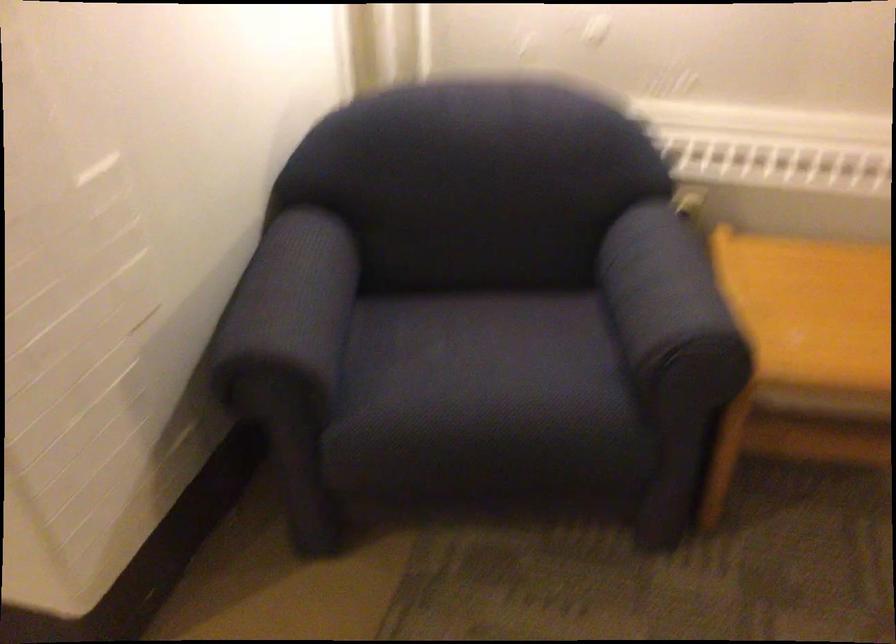
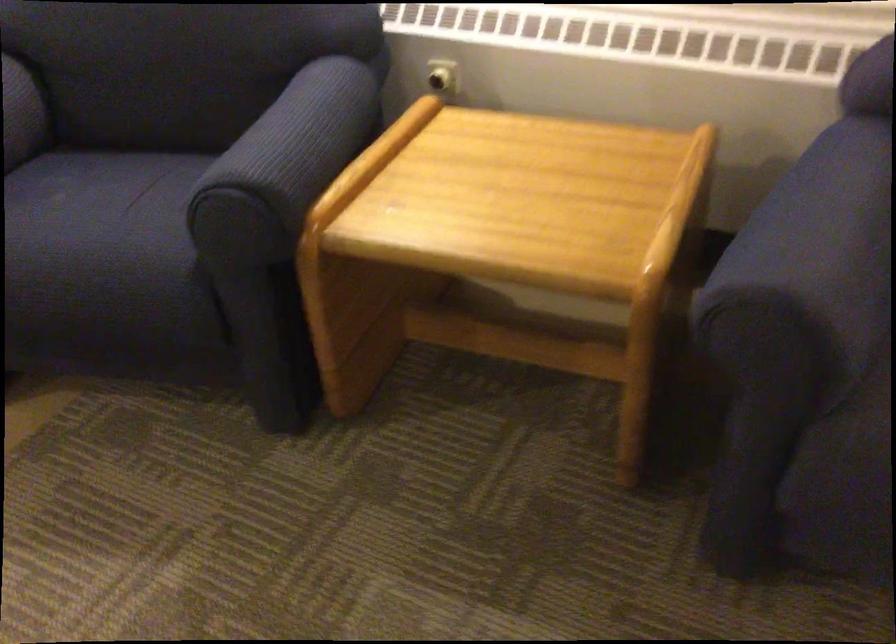
Question: Which direction would the cameraman need to move to produce the second image? Reply with the corresponding letter.

Choices:
 (A) Left
 (B) Right
 (C) Forward
 (D) Backward

Answer: (B)